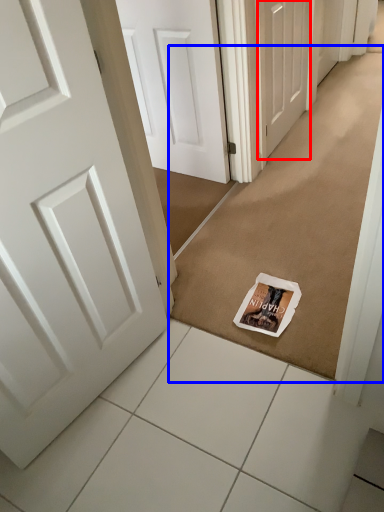
Question: Which object appears farthest to the camera in this image, door (highlighted by a red box) or doormat (highlighted by a blue box)?

Choices:
 (A) door
 (B) doormat

Answer: (A)